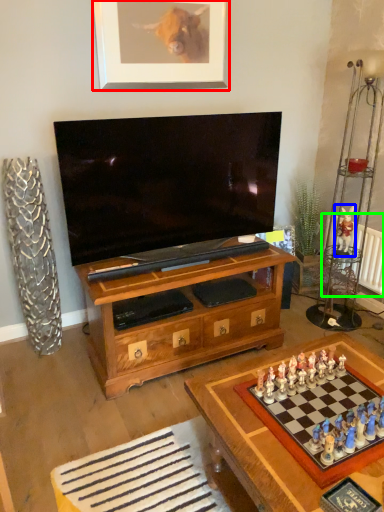
Question: Based on their relative distances, which object is farther from picture frame (highlighted by a red box)? Choose from toy (highlighted by a blue box) and radiator (highlighted by a green box).

Choices:
 (A) toy
 (B) radiator

Answer: (B)